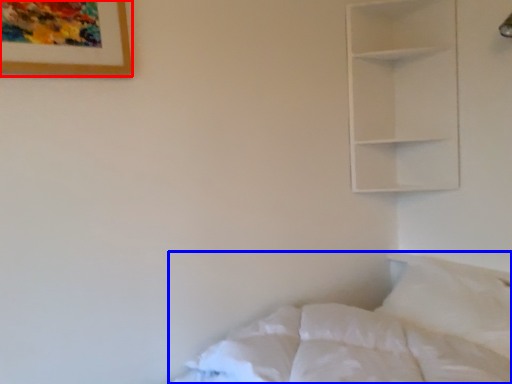
Question: Which point is closer to the camera, picture frame (highlighted by a red box) or bed (highlighted by a blue box)?

Choices:
 (A) picture frame
 (B) bed

Answer: (B)